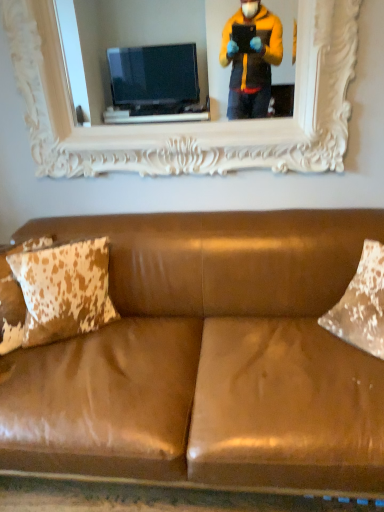
Question: Is brown leather couch at center positioned beyond the bounds of white carved wood picture frame at upper center?

Choices:
 (A) yes
 (B) no

Answer: (A)

Question: Is the surface of brown leather couch at center in direct contact with white carved wood picture frame at upper center?

Choices:
 (A) yes
 (B) no

Answer: (B)

Question: Is brown leather couch at center smaller than white carved wood picture frame at upper center?

Choices:
 (A) yes
 (B) no

Answer: (B)

Question: Can you confirm if brown leather couch at center is positioned to the right of white carved wood picture frame at upper center?

Choices:
 (A) yes
 (B) no

Answer: (B)

Question: Is brown leather couch at center facing towards white carved wood picture frame at upper center?

Choices:
 (A) no
 (B) yes

Answer: (A)

Question: Considering the relative sizes of brown leather couch at center and white carved wood picture frame at upper center in the image provided, is brown leather couch at center wider than white carved wood picture frame at upper center?

Choices:
 (A) yes
 (B) no

Answer: (A)

Question: Considering the relative sizes of white carved wood picture frame at upper center and brown cowhide pillow at left in the image provided, is white carved wood picture frame at upper center taller than brown cowhide pillow at left?

Choices:
 (A) no
 (B) yes

Answer: (B)

Question: From the image's perspective, does white carved wood picture frame at upper center appear higher than brown cowhide pillow at left?

Choices:
 (A) yes
 (B) no

Answer: (A)

Question: From the image's perspective, would you say white carved wood picture frame at upper center is shown under brown cowhide pillow at left?

Choices:
 (A) yes
 (B) no

Answer: (B)

Question: Considering the relative sizes of white carved wood picture frame at upper center and brown cowhide pillow at left in the image provided, is white carved wood picture frame at upper center shorter than brown cowhide pillow at left?

Choices:
 (A) no
 (B) yes

Answer: (A)

Question: Could you tell me if white carved wood picture frame at upper center is turned towards brown cowhide pillow at left?

Choices:
 (A) yes
 (B) no

Answer: (B)

Question: Is brown cowhide pillow at left at the back of white carved wood picture frame at upper center?

Choices:
 (A) yes
 (B) no

Answer: (B)

Question: Is brown cowhide pillow at left at the left side of brown leather couch at center?

Choices:
 (A) yes
 (B) no

Answer: (A)